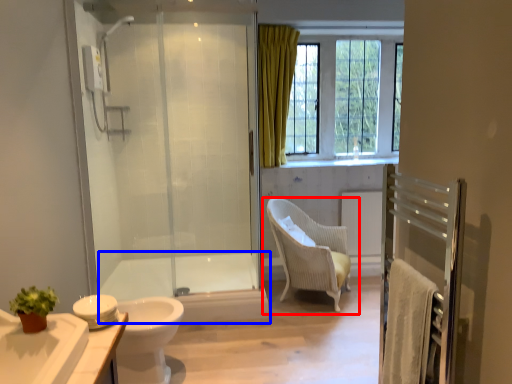
Question: Which object is further to the camera taking this photo, chair (highlighted by a red box) or bath (highlighted by a blue box)?

Choices:
 (A) chair
 (B) bath

Answer: (B)